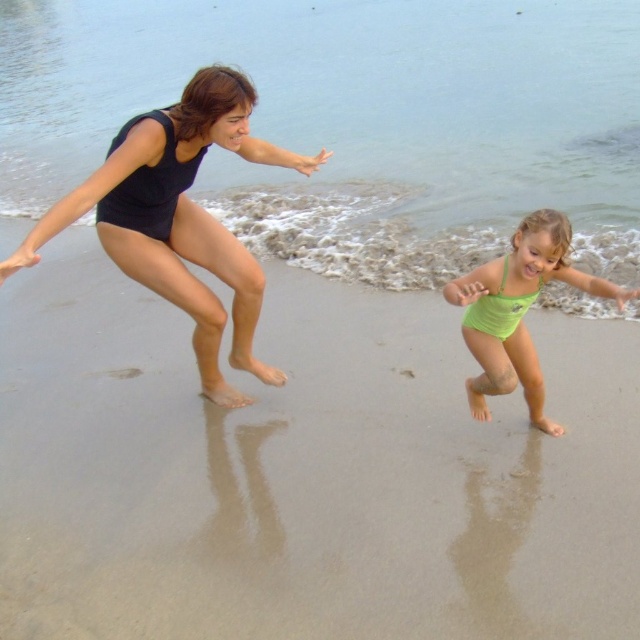
Consider the image. You are a photographer trying to capture the perfect shot of the clear blue water at center. Based on the scene, where should you position your camera to ensure the water is centered in your photo?

To center the clear blue water at center in your photo, position your camera at the coordinates specified by the point (353, 122).

You are a photographer trying to capture a candid shot of the two people in the image. You need to ensure that both the matte black swimsuit at left and the green matte swimsuit at center are in focus. Given that your camera has a depth of field that can cover 4 feet, will you be able to capture both subjects clearly in the same shot?

The matte black swimsuit at left and green matte swimsuit at center are 4.36 feet apart. Since the camera can cover 4 feet, the distance between them exceeds the depth of field capacity. Therefore, it might be challenging to keep both in focus simultaneously.

You are a photographer trying to capture the perfect shot of the matte black swimsuit at left and the bright green swimsuit on the right. Based on their positions, which swimsuit is closer to the left edge of the photo?

The matte black swimsuit at left is closer to the left edge of the photo since it is positioned at point 0.341 on the horizontal axis, which is closer to the left boundary compared to the bright green swimsuit on the right.